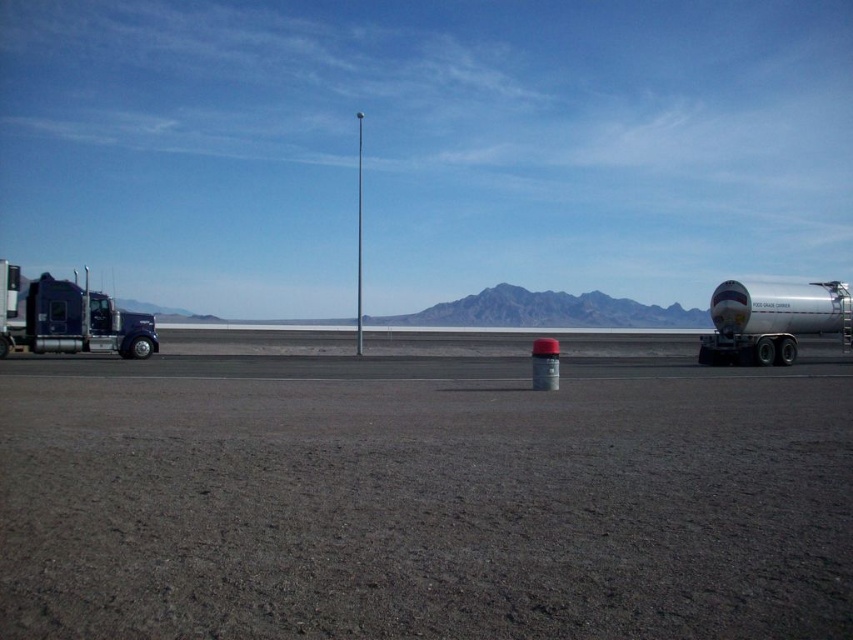
Based on the photo, does gray asphalt tarmac at center have a lesser width compared to brushed metal truck at left?

Yes.

Which is in front, point (109, 568) or point (80, 288)?

Point (109, 568) is more forward.

Is point (26, 627) behind point (109, 348)?

No, (26, 627) is in front of (109, 348).

The height and width of the screenshot is (640, 853). Find the location of `gray asphalt tarmac at center`. gray asphalt tarmac at center is located at coordinates (422, 499).

Can you confirm if gray asphalt tarmac at center is positioned below silver metallic tanker at right?

Correct, gray asphalt tarmac at center is located below silver metallic tanker at right.

Does gray asphalt tarmac at center appear on the right side of silver metallic tanker at right?

Incorrect, gray asphalt tarmac at center is not on the right side of silver metallic tanker at right.

Is point (827, 532) closer to camera compared to point (791, 301)?

Yes, point (827, 532) is closer to viewer.

Locate an element on the screen. The height and width of the screenshot is (640, 853). gray asphalt tarmac at center is located at coordinates (422, 499).

Measure the distance from silver metallic tanker at right to brushed metal truck at left.

silver metallic tanker at right and brushed metal truck at left are 31.19 meters apart from each other.

Can you confirm if silver metallic tanker at right is smaller than brushed metal truck at left?

Indeed, silver metallic tanker at right has a smaller size compared to brushed metal truck at left.

Locate an element on the screen. This screenshot has height=640, width=853. silver metallic tanker at right is located at coordinates (772, 321).